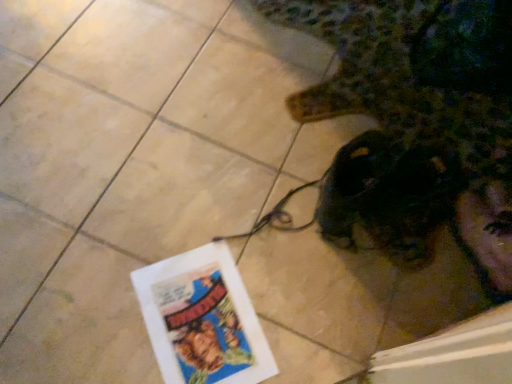
Question: Considering the positions of shiny black headphones at lower right and white paper flyer at lower left in the image, is shiny black headphones at lower right taller or shorter than white paper flyer at lower left?

Choices:
 (A) tall
 (B) short

Answer: (A)

Question: Considering the positions of shiny black headphones at lower right and white paper flyer at lower left in the image, is shiny black headphones at lower right wider or thinner than white paper flyer at lower left?

Choices:
 (A) thin
 (B) wide

Answer: (B)

Question: Looking at the image, does shiny black headphones at lower right seem bigger or smaller compared to white paper flyer at lower left?

Choices:
 (A) small
 (B) big

Answer: (B)

Question: Is white paper flyer at lower left inside the boundaries of shiny black headphones at lower right, or outside?

Choices:
 (A) outside
 (B) inside

Answer: (A)

Question: Based on their sizes in the image, would you say white paper flyer at lower left is bigger or smaller than shiny black headphones at lower right?

Choices:
 (A) small
 (B) big

Answer: (A)

Question: Looking at their shapes, would you say white paper flyer at lower left is wider or thinner than shiny black headphones at lower right?

Choices:
 (A) thin
 (B) wide

Answer: (A)

Question: From a real-world perspective, relative to shiny black headphones at lower right, is white paper flyer at lower left vertically above or below?

Choices:
 (A) below
 (B) above

Answer: (A)